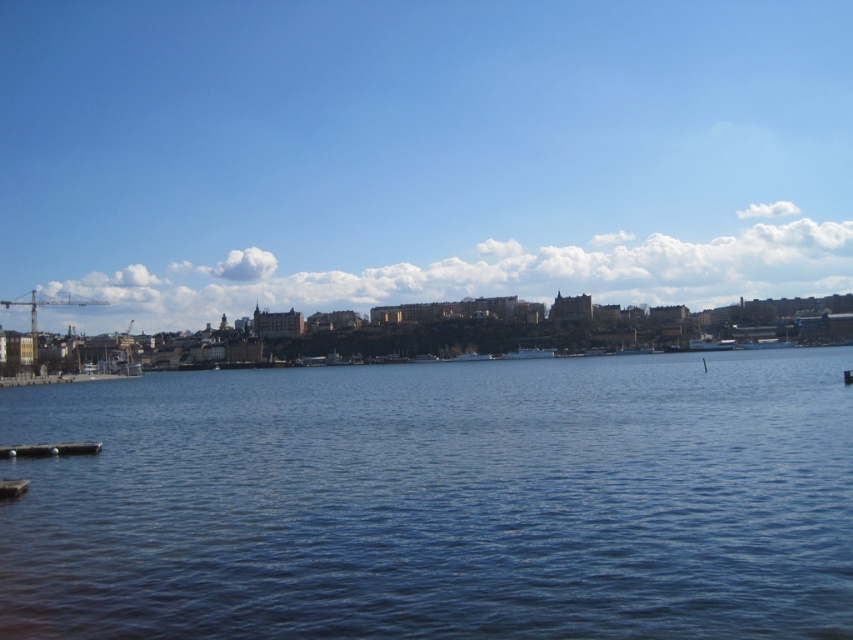
Question: Is blue liquid water at center wider than smooth wooden dock at lower left?

Choices:
 (A) yes
 (B) no

Answer: (A)

Question: Is blue liquid water at center to the left of smooth wooden dock at lower left from the viewer's perspective?

Choices:
 (A) yes
 (B) no

Answer: (B)

Question: Among these objects, which one is nearest to the camera?

Choices:
 (A) brown wooden dock at lower left
 (B) smooth wooden dock at lower left
 (C) blue liquid water at center

Answer: (C)

Question: Which is nearer to the blue liquid water at center?

Choices:
 (A) brown wooden dock at lower left
 (B) smooth wooden dock at lower left

Answer: (B)

Question: From the image, what is the correct spatial relationship of blue liquid water at center in relation to brown wooden dock at lower left?

Choices:
 (A) above
 (B) below

Answer: (B)

Question: Among these points, which one is nearest to the camera?

Choices:
 (A) (550, 628)
 (B) (4, 490)

Answer: (A)